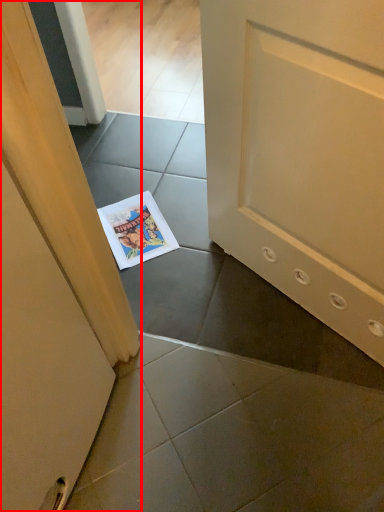
Question: Where is door (annotated by the red box) located in relation to comic book in the image?

Choices:
 (A) right
 (B) left

Answer: (B)